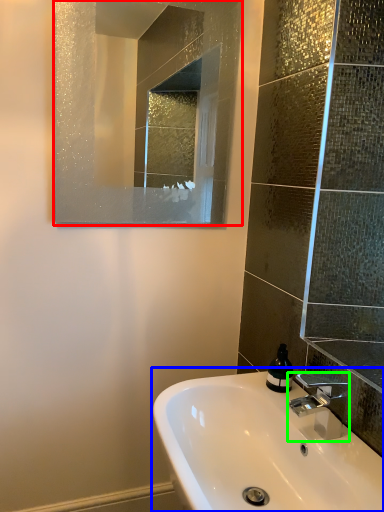
Question: Estimate the real-world distances between objects in this image. Which object is closer to mirror (highlighted by a red box), sink (highlighted by a blue box) or tap (highlighted by a green box)?

Choices:
 (A) sink
 (B) tap

Answer: (A)